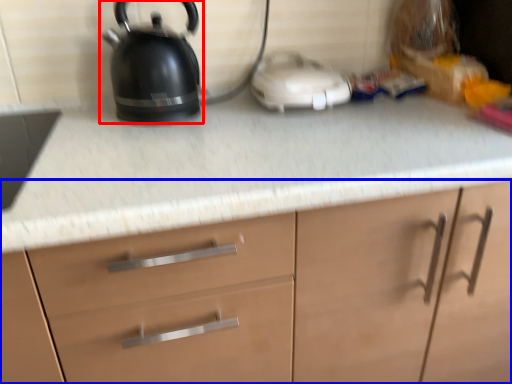
Question: Which point is closer to the camera, kettle (highlighted by a red box) or cabinetry (highlighted by a blue box)?

Choices:
 (A) kettle
 (B) cabinetry

Answer: (B)